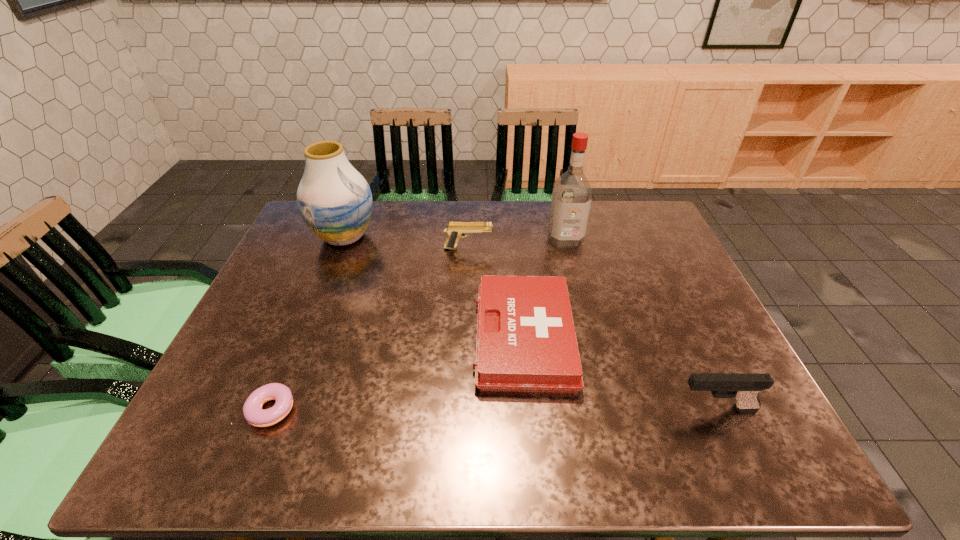
The width and height of the screenshot is (960, 540). What are the coordinates of `liquor` in the screenshot? It's located at (572, 193).

This screenshot has height=540, width=960. Identify the location of vase. (335, 201).

Find the location of a particular element. This screenshot has width=960, height=540. the nearer pistol is located at coordinates (745, 388).

Where is `the rightmost object`? This screenshot has height=540, width=960. the rightmost object is located at coordinates (745, 388).

Locate an element on the screen. the left pistol is located at coordinates (455, 230).

Locate an element on the screen. This screenshot has height=540, width=960. the third shortest object is located at coordinates (455, 230).

You are a GUI agent. You are given a task and a screenshot of the screen. Output one action in this format:
    pyautogui.click(x=<x>, y=<y>)
    Task: Click on the fifth tallest object
    The width and height of the screenshot is (960, 540).
    Given the screenshot: What is the action you would take?
    pyautogui.click(x=526, y=342)

Find the location of `doughnut`. doughnut is located at coordinates (254, 414).

At what (x,y) coordinates should I click in order to perform the action: click on free space located on the front-facing side of the liquor. Please return your answer as a coordinate pair (x, y). This screenshot has width=960, height=540. Looking at the image, I should click on (577, 287).

At what (x,y) coordinates should I click in order to perform the action: click on vacant space positioned 0.140m on the right of the vase. Please return your answer as a coordinate pair (x, y). This screenshot has height=540, width=960. Looking at the image, I should click on [x=423, y=237].